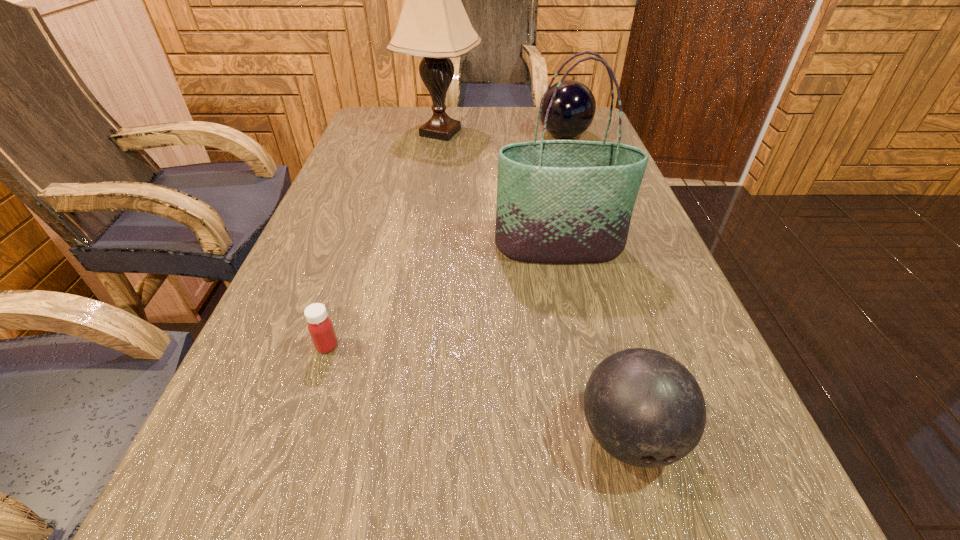
The width and height of the screenshot is (960, 540). In order to click on lamp in this screenshot , I will do `click(433, 23)`.

You are a GUI agent. You are given a task and a screenshot of the screen. Output one action in this format:
    pyautogui.click(x=<x>, y=<y>)
    Task: Click on the tote bag
    Image resolution: width=960 pixels, height=540 pixels.
    Given the screenshot: What is the action you would take?
    pyautogui.click(x=558, y=201)

At what (x,y) coordinates should I click in order to perform the action: click on the third farthest object. Please return your answer as a coordinate pair (x, y). Looking at the image, I should click on (558, 201).

You are a GUI agent. You are given a task and a screenshot of the screen. Output one action in this format:
    pyautogui.click(x=<x>, y=<y>)
    Task: Click on the farther bowling ball
    Image resolution: width=960 pixels, height=540 pixels.
    Given the screenshot: What is the action you would take?
    pyautogui.click(x=573, y=109)

I want to click on the nearest object, so click(x=645, y=408).

The width and height of the screenshot is (960, 540). Find the location of `medicine`. medicine is located at coordinates (320, 327).

At what (x,y) coordinates should I click in order to perform the action: click on the shortest object. Please return your answer as a coordinate pair (x, y). The image size is (960, 540). Looking at the image, I should click on (320, 327).

This screenshot has height=540, width=960. I want to click on vacant area situated 0.190m on the right of the lamp, so click(x=544, y=132).

Find the location of a particular element. The width and height of the screenshot is (960, 540). vacant region located on the back of the tote bag is located at coordinates (539, 151).

The height and width of the screenshot is (540, 960). I want to click on vacant region located 0.180m on the side of the farther bowling ball with the finger holes, so click(477, 136).